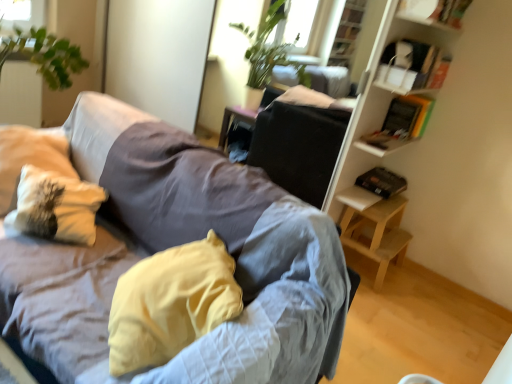
Question: Considering the relative positions of yellow fabric pillow at center, which is counted as the first pillow, starting from the right, and wooden bookshelf at right in the image provided, is yellow fabric pillow at center, which is counted as the first pillow, starting from the right, to the left of wooden bookshelf at right from the viewer's perspective?

Choices:
 (A) yes
 (B) no

Answer: (A)

Question: Is wooden bookshelf at right a part of yellow fabric pillow at center, which is counted as the first pillow, starting from the right?

Choices:
 (A) no
 (B) yes

Answer: (A)

Question: From the image's perspective, would you say yellow fabric pillow at center, the 2th pillow when ordered from left to right, is positioned over wooden bookshelf at right?

Choices:
 (A) yes
 (B) no

Answer: (B)

Question: Can you confirm if yellow fabric pillow at center, the 2th pillow when ordered from left to right, is positioned to the right of wooden bookshelf at right?

Choices:
 (A) no
 (B) yes

Answer: (A)

Question: Can you confirm if yellow fabric pillow at center, which is counted as the first pillow, starting from the right, is thinner than wooden bookshelf at right?

Choices:
 (A) no
 (B) yes

Answer: (A)

Question: Is yellow fabric pillow at center, which is counted as the first pillow, starting from the right, behind wooden bookshelf at right?

Choices:
 (A) yes
 (B) no

Answer: (B)

Question: Is yellow fabric pillow at center, the 2th pillow when ordered from left to right, completely or partially outside of white textured pillow at left, which is the 1th pillow in left-to-right order?

Choices:
 (A) yes
 (B) no

Answer: (A)

Question: From the image's perspective, would you say yellow fabric pillow at center, the 2th pillow when ordered from left to right, is positioned over white textured pillow at left, which is the 1th pillow in left-to-right order?

Choices:
 (A) no
 (B) yes

Answer: (A)

Question: Is yellow fabric pillow at center, the 2th pillow when ordered from left to right, to the right of white textured pillow at left, marked as the second pillow in a right-to-left arrangement, from the viewer's perspective?

Choices:
 (A) yes
 (B) no

Answer: (A)

Question: Is yellow fabric pillow at center, which is counted as the first pillow, starting from the right, further to camera compared to white textured pillow at left, marked as the second pillow in a right-to-left arrangement?

Choices:
 (A) yes
 (B) no

Answer: (B)

Question: Is yellow fabric pillow at center, which is counted as the first pillow, starting from the right, closer to camera compared to white textured pillow at left, which is the 1th pillow in left-to-right order?

Choices:
 (A) no
 (B) yes

Answer: (B)

Question: Are yellow fabric pillow at center, the 2th pillow when ordered from left to right, and white textured pillow at left, marked as the second pillow in a right-to-left arrangement, beside each other?

Choices:
 (A) no
 (B) yes

Answer: (A)

Question: Does white textured pillow at left, which is the 1th pillow in left-to-right order, lie behind white cardboard box at upper right, which is counted as the second shelf, starting from the top?

Choices:
 (A) no
 (B) yes

Answer: (A)